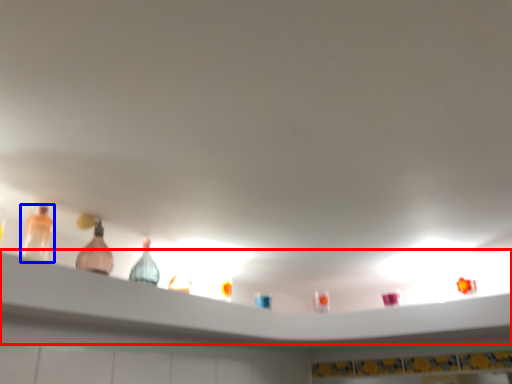
Question: Among these objects, which one is nearest to the camera, shelf (highlighted by a red box) or bottle (highlighted by a blue box)?

Choices:
 (A) shelf
 (B) bottle

Answer: (A)